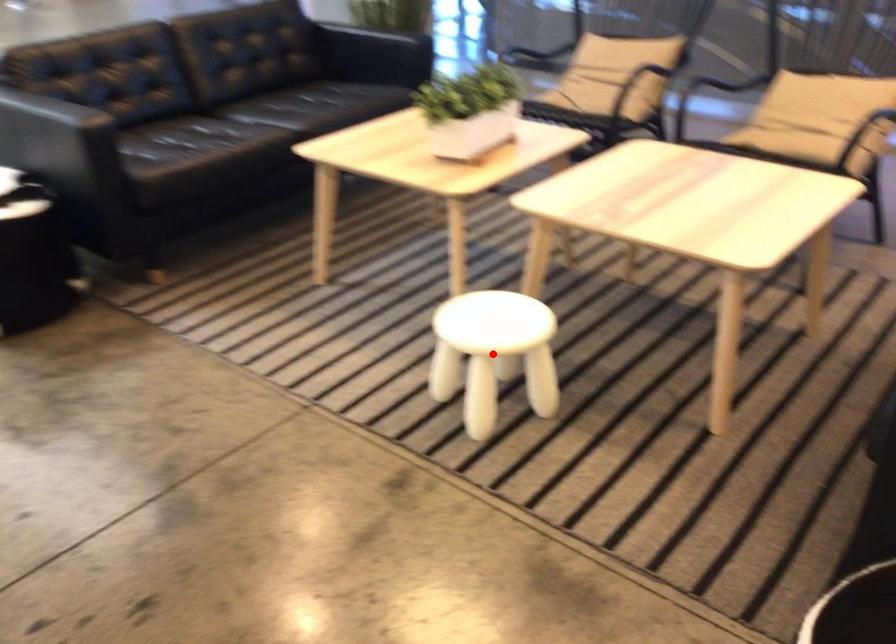
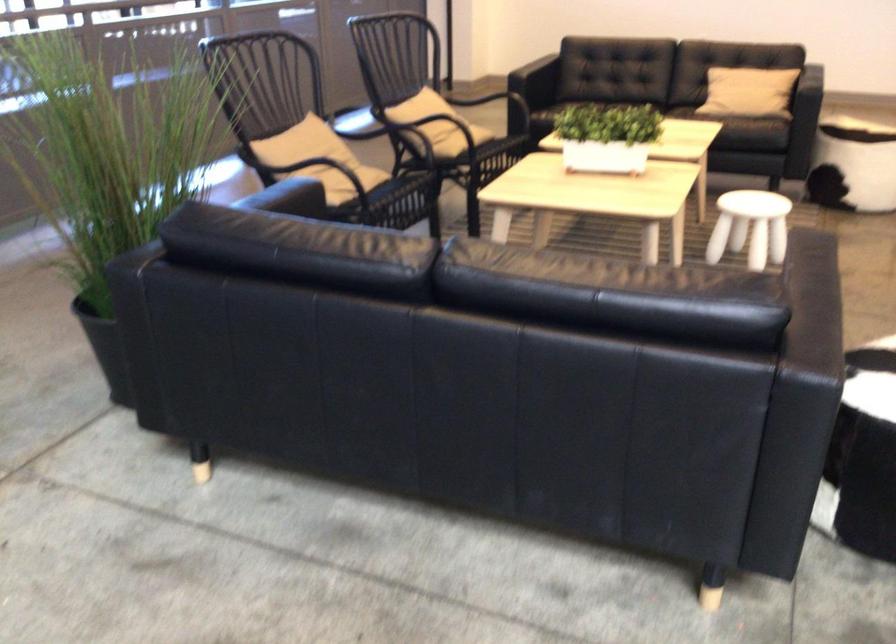
Question: I am providing you with two images of the same scene from different viewpoints. A red point is marked on the first image. Is the red point's position out of view in image 2?

Choices:
 (A) Yes
 (B) No

Answer: (A)